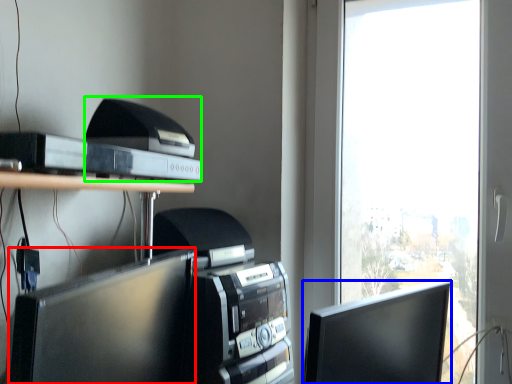
Question: Based on their relative distances, which object is farther from computer monitor (highlighted by a red box)? Choose from computer monitor (highlighted by a blue box) and printer (highlighted by a green box).

Choices:
 (A) computer monitor
 (B) printer

Answer: (A)